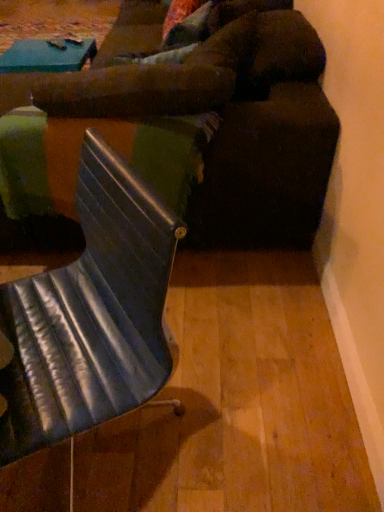
Identify the location of free space to the right of metallic blue chair at center. (243, 396).